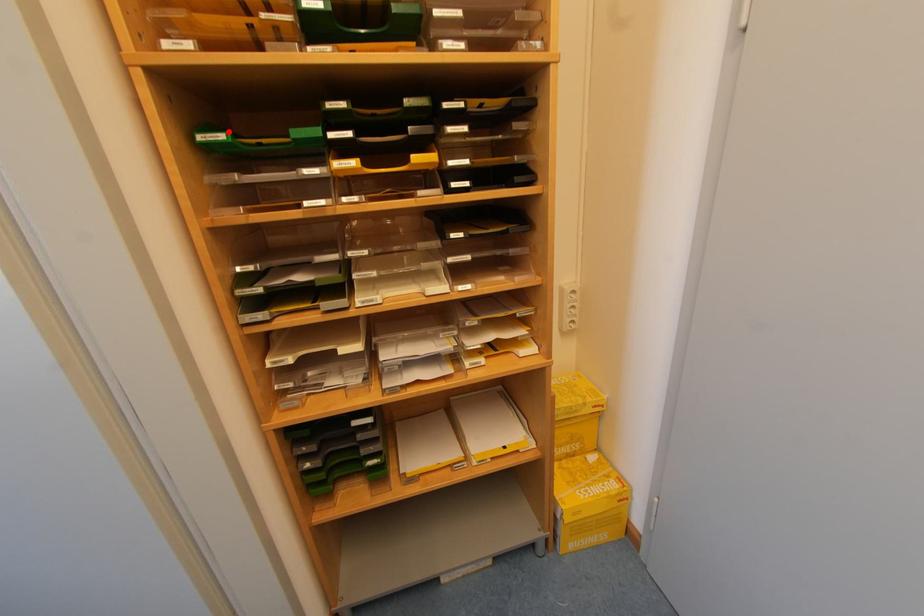
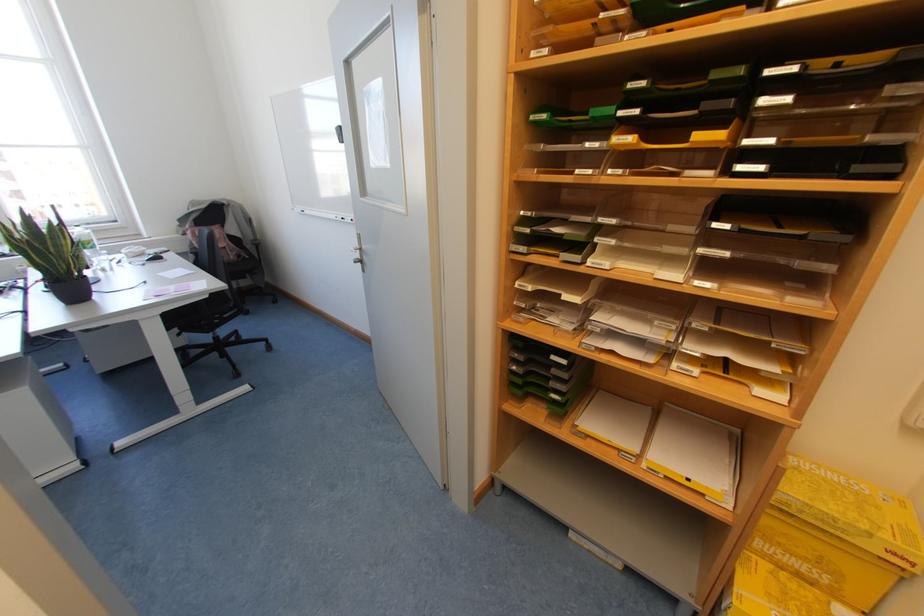
Where in the second image is the point corresponding to the highlighted location from the first image?

(550, 111)